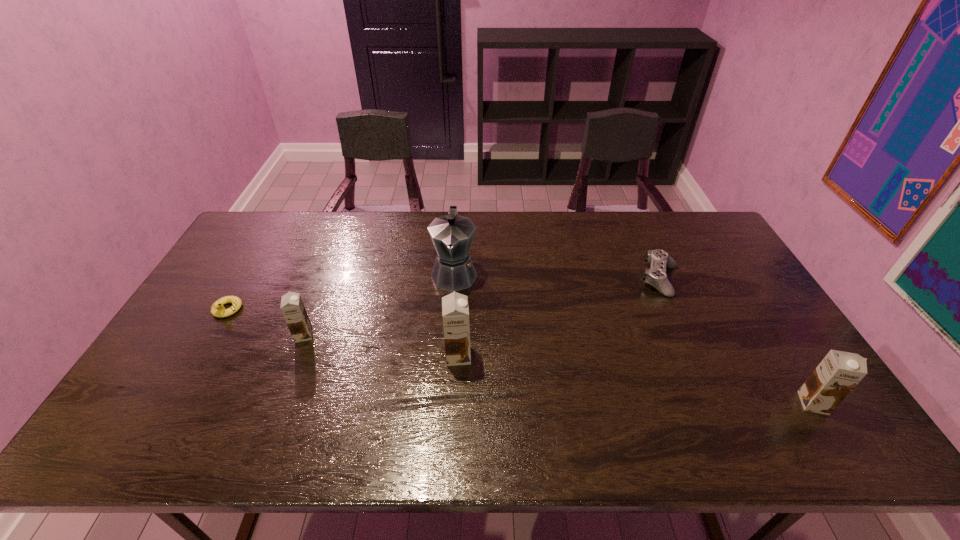
The width and height of the screenshot is (960, 540). Find the location of `free spot that satisfies the following two spatial constraints: 1. on the back side of the control; 2. on the left side of the leftmost chocolate milk`. free spot that satisfies the following two spatial constraints: 1. on the back side of the control; 2. on the left side of the leftmost chocolate milk is located at coordinates (325, 280).

The width and height of the screenshot is (960, 540). I want to click on free space that satisfies the following two spatial constraints: 1. on the face of the leftmost object; 2. on the left side of the fourth shortest object, so click(173, 403).

Locate an element on the screen. The image size is (960, 540). free location that satisfies the following two spatial constraints: 1. on the back side of the second nearest chocolate milk; 2. on the right side of the fifth object from left to right is located at coordinates (462, 280).

Where is `vacant position in the image that satisfies the following two spatial constraints: 1. on the front side of the second object from left to right; 2. on the right side of the fifth farthest object`? The image size is (960, 540). vacant position in the image that satisfies the following two spatial constraints: 1. on the front side of the second object from left to right; 2. on the right side of the fifth farthest object is located at coordinates (296, 356).

Where is `vacant space that satisfies the following two spatial constraints: 1. on the face of the nearest object; 2. on the left side of the duckling`? vacant space that satisfies the following two spatial constraints: 1. on the face of the nearest object; 2. on the left side of the duckling is located at coordinates (173, 403).